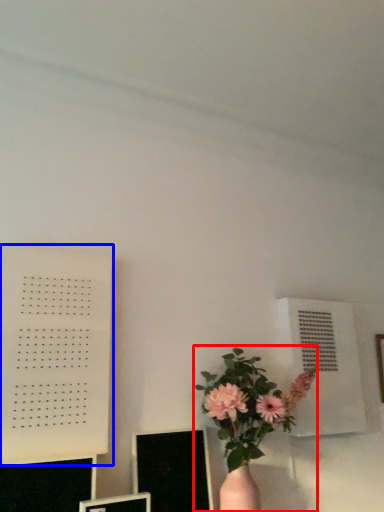
Question: Which object is further to the camera taking this photo, houseplant (highlighted by a red box) or bulletin board (highlighted by a blue box)?

Choices:
 (A) houseplant
 (B) bulletin board

Answer: (B)